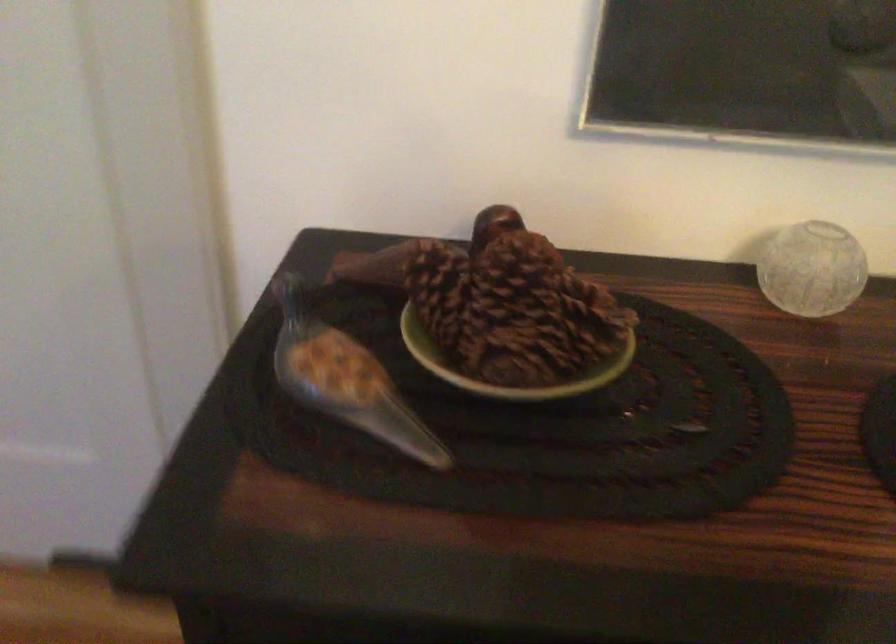
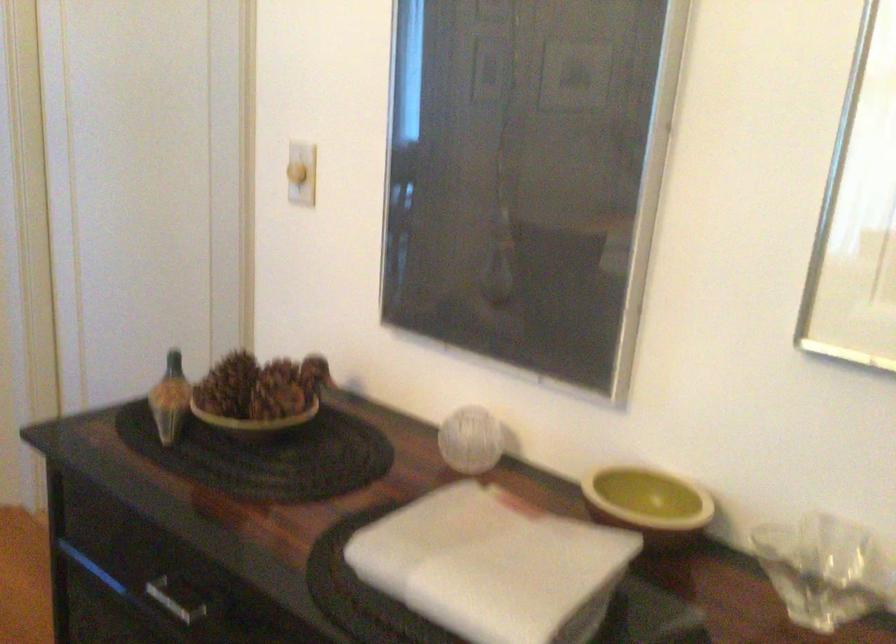
Locate, in the second image, the point that corresponds to (369,351) in the first image.

(169, 399)